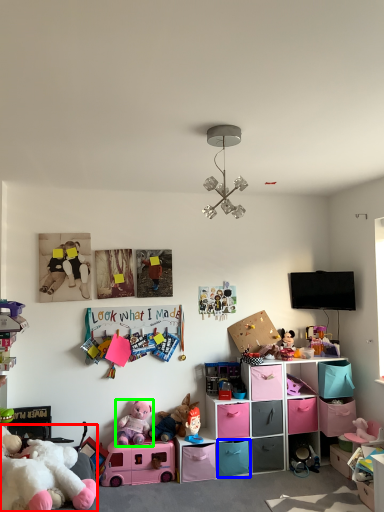
Question: Which is farther away from toy (highlighted by a red box)? drawer (highlighted by a blue box) or toy (highlighted by a green box)?

Choices:
 (A) drawer
 (B) toy

Answer: (A)